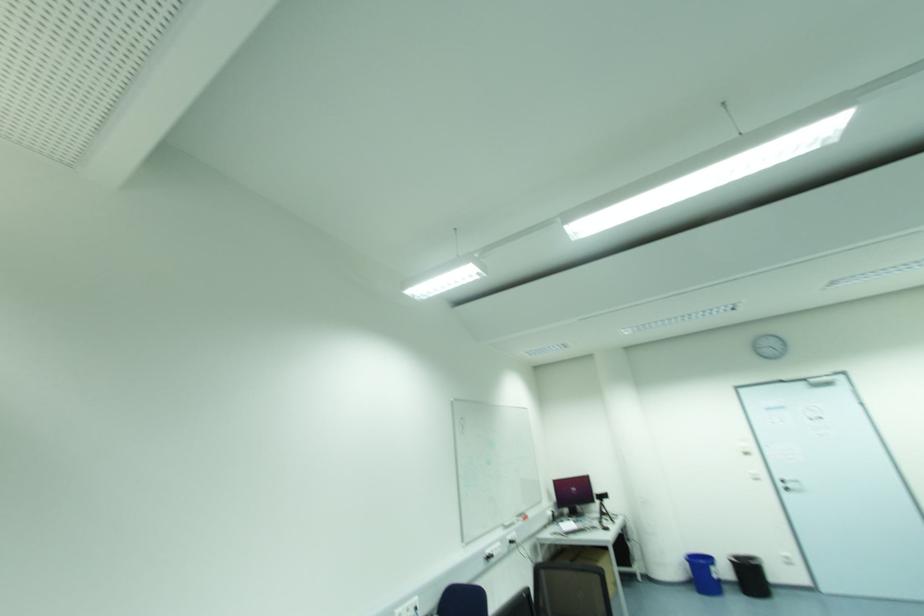
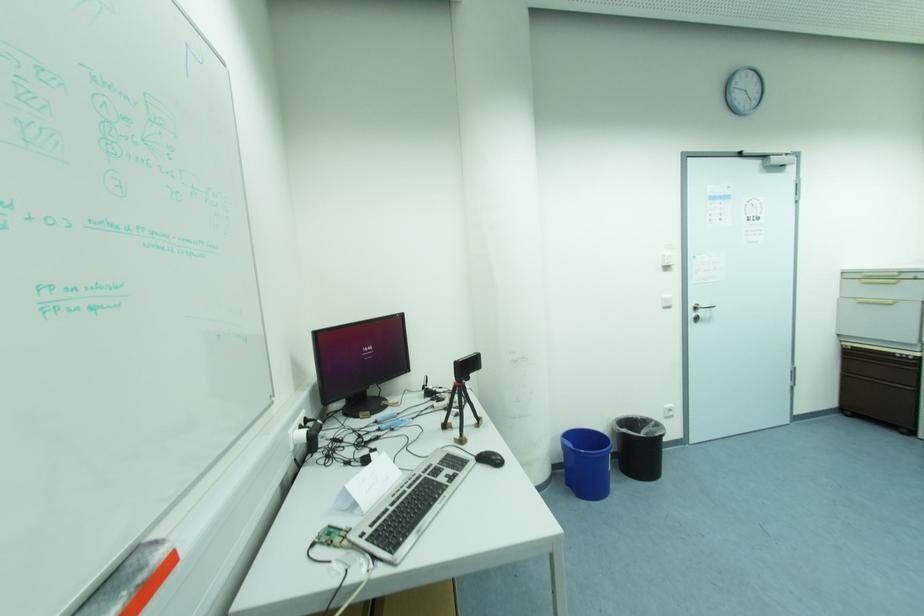
Find the pixel in the second image that matches point (783, 482) in the first image.

(697, 309)